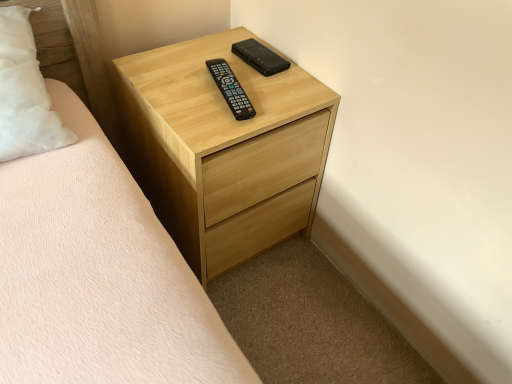
Where is `free point to the left of black plastic remote at center, the first control from the front`? The height and width of the screenshot is (384, 512). free point to the left of black plastic remote at center, the first control from the front is located at coordinates (177, 92).